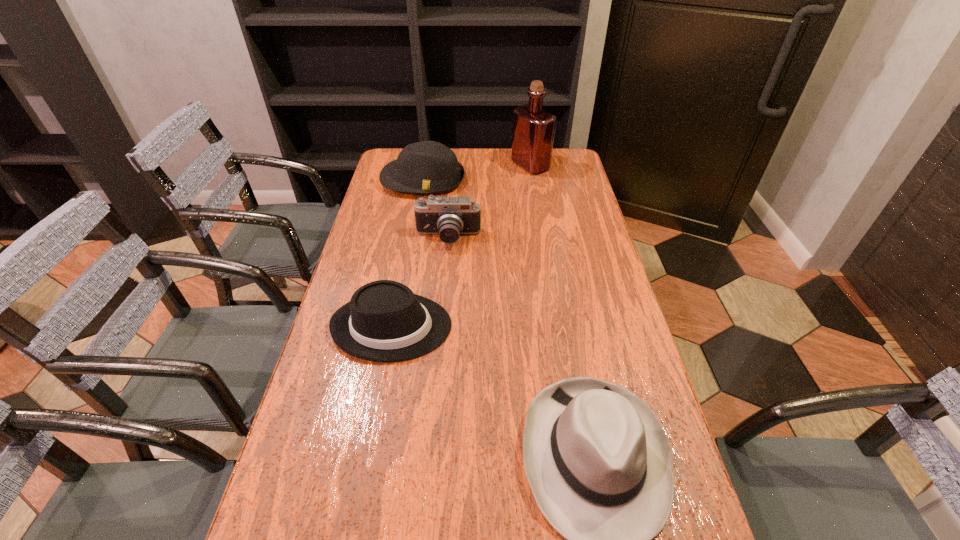
Identify which object is located as the third nearest to the camera. Please provide its 2D coordinates. Your answer should be formatted as a tuple, i.e. [(x, y)], where the tuple contains the x and y coordinates of a point satisfying the conditions above.

[(533, 128)]

Identify the location of fedora that is the closest one to the camera. Image resolution: width=960 pixels, height=540 pixels. (428, 167).

Where is `fedora that is the second closest to the nearest fedora`? The width and height of the screenshot is (960, 540). fedora that is the second closest to the nearest fedora is located at coordinates (428, 167).

Where is `free location that satisfies the following two spatial constraints: 1. on the front-facing side of the third farthest object; 2. on the front-facing side of the second nearest object`? Image resolution: width=960 pixels, height=540 pixels. free location that satisfies the following two spatial constraints: 1. on the front-facing side of the third farthest object; 2. on the front-facing side of the second nearest object is located at coordinates (441, 327).

Find the location of `vacant space that satisfies the following two spatial constraints: 1. on the front-facing side of the third farthest object; 2. on the front-facing side of the second nearest fedora`. vacant space that satisfies the following two spatial constraints: 1. on the front-facing side of the third farthest object; 2. on the front-facing side of the second nearest fedora is located at coordinates (441, 327).